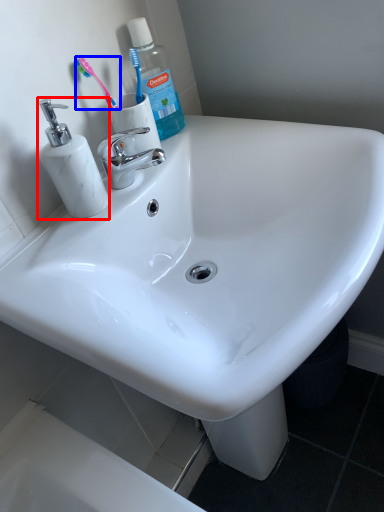
Question: Which point is closer to the camera, soap dispenser (highlighted by a red box) or toothbrush (highlighted by a blue box)?

Choices:
 (A) soap dispenser
 (B) toothbrush

Answer: (A)